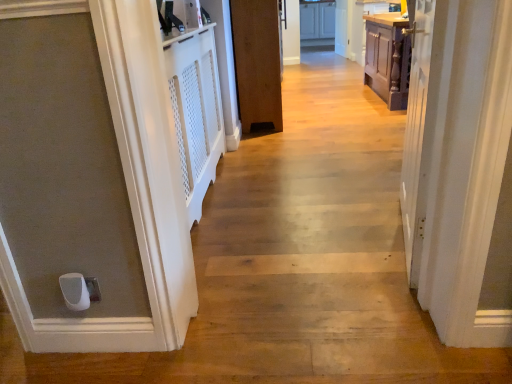
Find the location of a particular element. This screenshot has height=384, width=512. free location to the right of brown wood door at center is located at coordinates (336, 109).